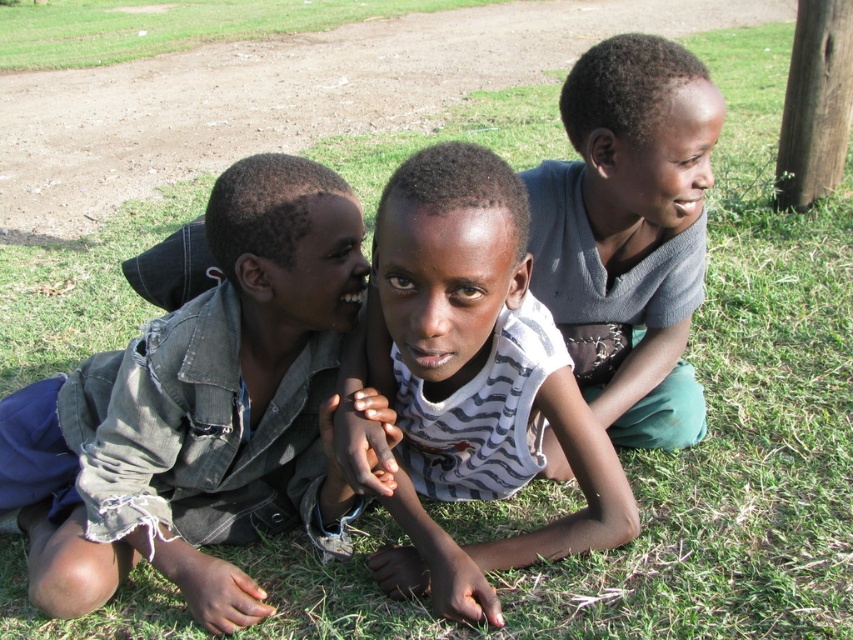
You are a photographer trying to capture a candid shot of the two boys at the center. You notice the ripped denim jacket at center and the striped fabric shirt at center. Which object should you focus on if you want to capture the boy who is lying on his stomach?

The boy lying on his stomach is wearing the striped fabric shirt at center, so you should focus on the striped fabric shirt at center to capture him.

You are a photographer trying to capture a candid shot of the gray matte shirt at upper right without the ripped denim jacket at center blocking the view. Is it possible to adjust your position to achieve this?

The ripped denim jacket at center is in front of the gray matte shirt at upper right, so you would need to move to a position where the jacket is no longer blocking the shirt to capture the shot without obstruction.